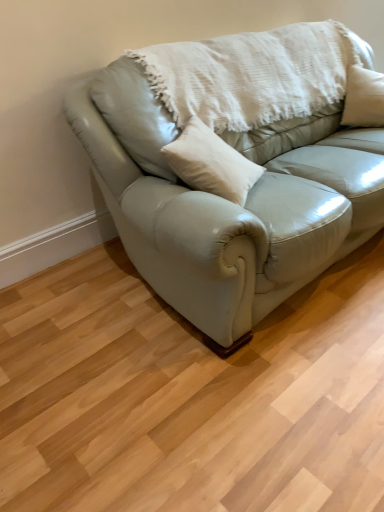
Question: From the image's perspective, relative to light gray leather couch at center, is white textured blanket at upper center above or below?

Choices:
 (A) above
 (B) below

Answer: (A)

Question: Would you say white textured blanket at upper center is inside or outside light gray leather couch at center?

Choices:
 (A) outside
 (B) inside

Answer: (B)

Question: From a real-world perspective, relative to light gray leather couch at center, is white textured blanket at upper center vertically above or below?

Choices:
 (A) above
 (B) below

Answer: (A)

Question: Considering the positions of point (347, 99) and point (228, 34), is point (347, 99) closer or farther from the camera than point (228, 34)?

Choices:
 (A) farther
 (B) closer

Answer: (A)

Question: Considering the positions of light gray leather couch at center and white textured blanket at upper center in the image, is light gray leather couch at center bigger or smaller than white textured blanket at upper center?

Choices:
 (A) big
 (B) small

Answer: (A)

Question: Looking at their shapes, would you say light gray leather couch at center is wider or thinner than white textured blanket at upper center?

Choices:
 (A) wide
 (B) thin

Answer: (A)

Question: Is light gray leather couch at center inside the boundaries of white textured blanket at upper center, or outside?

Choices:
 (A) outside
 (B) inside

Answer: (A)